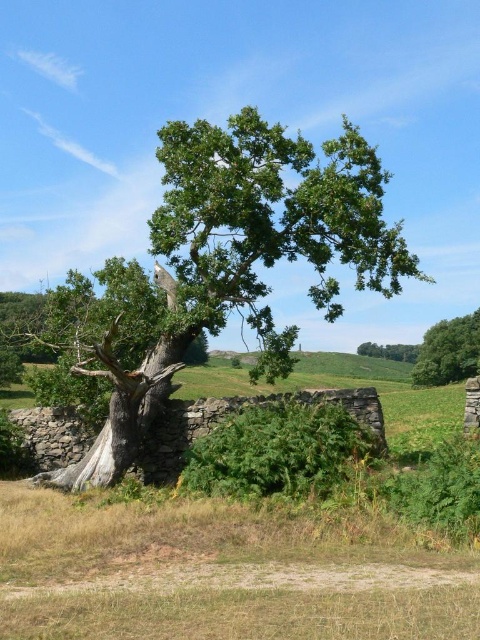
You are a bird seeking shelter in the green leafy oak tree at center and the green leafy tree at upper right. Which tree would provide more coverage due to its larger size?

The green leafy oak tree at center provides more coverage because its width surpasses that of the green leafy tree at upper right.

You are standing in the middle of a rural landscape and see the green leafy oak tree at center and the green leafy tree at upper right. Which tree would appear larger to you?

The green leafy oak tree at center would appear larger because it is closer to you than the green leafy tree at upper right.

You are an ornithologist observing birds in the green leafy oak tree at center and the green leafy tree at upper right. Which tree would you recommend for a birdwatching spot that offers a better vantage point due to height?

The green leafy oak tree at center is taller than the green leafy tree at upper right, so it would provide a better vantage point for birdwatching.